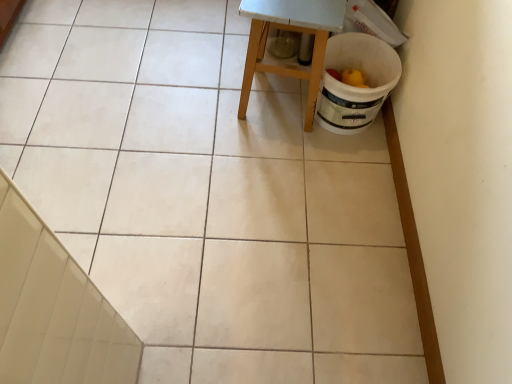
What do you see at coordinates (292, 31) in the screenshot? I see `wooden stool at center` at bounding box center [292, 31].

Measure the distance between point (262, 36) and camera.

4.60 feet.

You are a GUI agent. You are given a task and a screenshot of the screen. Output one action in this format:
    pyautogui.click(x=<x>, y=<y>)
    Task: Click on the wooden stool at center
    This screenshot has width=512, height=384.
    Given the screenshot: What is the action you would take?
    pyautogui.click(x=292, y=31)

What is the approximate width of white glossy tile at lower left?

white glossy tile at lower left is 1.21 inches wide.

The width and height of the screenshot is (512, 384). What do you see at coordinates (54, 308) in the screenshot? I see `white glossy tile at lower left` at bounding box center [54, 308].

Locate an element on the screen. white glossy tile at lower left is located at coordinates (54, 308).

The image size is (512, 384). I want to click on wooden stool at center, so click(292, 31).

Between wooden stool at center and white glossy tile at lower left, which one appears on the right side from the viewer's perspective?

wooden stool at center.

Which is behind, wooden stool at center or white glossy tile at lower left?

wooden stool at center is more distant.

Which point is more distant from viewer, (245, 96) or (32, 374)?

The point (245, 96) is more distant.

From the image's perspective, which object appears higher, wooden stool at center or white glossy tile at lower left?

wooden stool at center, from the image's perspective.

From a real-world perspective, is wooden stool at center positioned under white glossy tile at lower left based on gravity?

Yes, from a real-world perspective, wooden stool at center is beneath white glossy tile at lower left.

Considering the sizes of wooden stool at center and white glossy tile at lower left in the image, is wooden stool at center wider or thinner than white glossy tile at lower left?

In the image, wooden stool at center appears to be wider than white glossy tile at lower left.

Considering the sizes of objects wooden stool at center and white glossy tile at lower left in the image provided, who is shorter, wooden stool at center or white glossy tile at lower left?

wooden stool at center.

Does wooden stool at center have a smaller size compared to white glossy tile at lower left?

No.

Is wooden stool at center inside or outside of white glossy tile at lower left?

wooden stool at center is spatially situated outside white glossy tile at lower left.

Would you consider wooden stool at center to be distant from white glossy tile at lower left?

That's right, there is a large distance between wooden stool at center and white glossy tile at lower left.

Looking at this image, does wooden stool at center turn towards white glossy tile at lower left?

No, wooden stool at center is not turned towards white glossy tile at lower left.

Based on the photo, how different are the orientations of wooden stool at center and white glossy tile at lower left in degrees?

The angular difference between wooden stool at center and white glossy tile at lower left is 171 degrees.

Find the location of `furniture on the right side of white glossy tile at lower left`. furniture on the right side of white glossy tile at lower left is located at coordinates (292, 31).

Is white glossy tile at lower left to the left of wooden stool at center from the viewer's perspective?

Yes.

Considering the relative positions of white glossy tile at lower left and wooden stool at center in the image provided, is white glossy tile at lower left behind wooden stool at center?

No, white glossy tile at lower left is closer to the viewer.

Does point (32, 331) lie behind point (286, 22)?

No, (32, 331) is in front of (286, 22).

From the image's perspective, which is below, white glossy tile at lower left or wooden stool at center?

white glossy tile at lower left.

From a real-world perspective, is white glossy tile at lower left on top of wooden stool at center?

Indeed, from a real-world perspective, white glossy tile at lower left stands above wooden stool at center.

Is white glossy tile at lower left wider or thinner than wooden stool at center?

In the image, white glossy tile at lower left appears to be more narrow than wooden stool at center.

Consider the image. Does white glossy tile at lower left have a lesser height compared to wooden stool at center?

In fact, white glossy tile at lower left may be taller than wooden stool at center.

Is white glossy tile at lower left smaller than wooden stool at center?

Yes, white glossy tile at lower left is smaller than wooden stool at center.

Is white glossy tile at lower left surrounding wooden stool at center?

No, white glossy tile at lower left does not contain wooden stool at center.

Can you see white glossy tile at lower left touching wooden stool at center?

No.

Looking at this image, could you tell me if white glossy tile at lower left is turned towards wooden stool at center?

No, white glossy tile at lower left is not facing towards wooden stool at center.

Can you tell me how much white glossy tile at lower left and wooden stool at center differ in facing direction?

171 degrees.

I want to click on furniture below the white glossy tile at lower left (from a real-world perspective), so pyautogui.click(x=292, y=31).

Where is `stair to the left of wooden stool at center`? The height and width of the screenshot is (384, 512). stair to the left of wooden stool at center is located at coordinates (54, 308).

Image resolution: width=512 pixels, height=384 pixels. I want to click on furniture that is behind the white glossy tile at lower left, so click(292, 31).